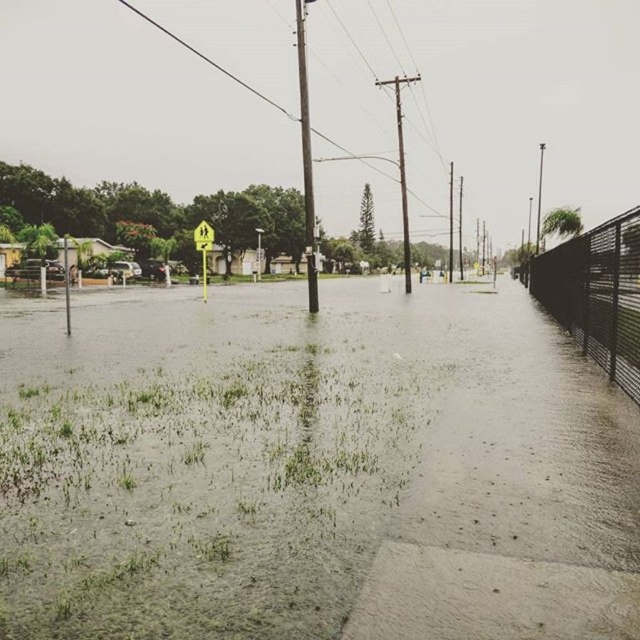
You are a delivery robot navigating a flooded street. You need to reach a delivery point located beyond the yellow plastic sign at center. The black metal fence at right is blocking your path. Can you go around the fence to reach the sign?

The black metal fence at right is closer to the viewer than the yellow plastic sign at center, so you can go around the fence to reach the sign because the fence is in front of you and the sign is further away.

You are a delivery drone operator. Your drone has a minimum flight altitude of 3 meters to avoid obstacles. You need to fly over the flooded area shown in the image. Can the drone safely fly over the muddy water at center?

The distance between the muddy water at center and the camera is 2.57 meters. Since the drone requires a minimum flight altitude of 3 meters to avoid obstacles, it cannot safely fly over the muddy water at center as the required altitude is not met.